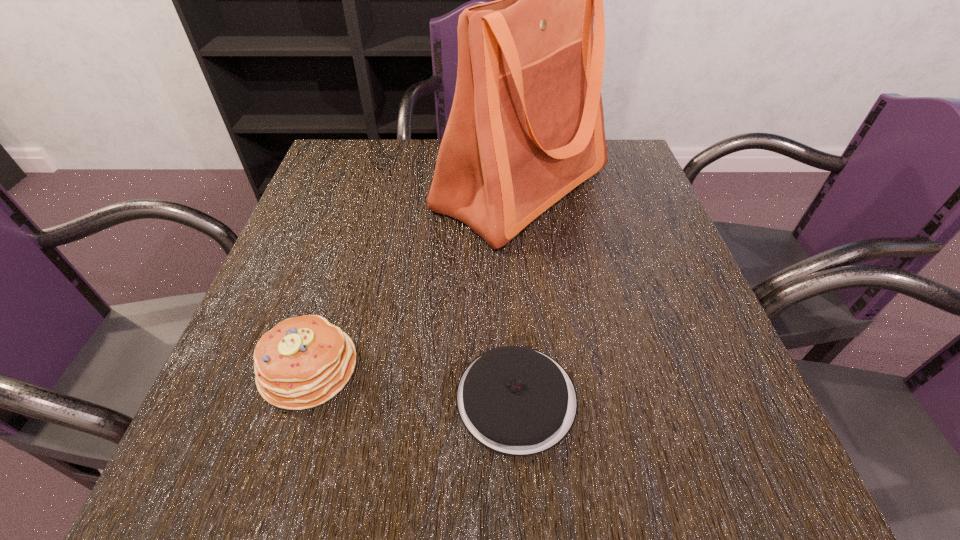
Locate an element on the screen. the farthest object is located at coordinates (526, 127).

This screenshot has width=960, height=540. Find the location of `the tallest object`. the tallest object is located at coordinates (526, 127).

This screenshot has height=540, width=960. I want to click on the second tallest object, so click(x=304, y=361).

Where is `the taller pancake`? The height and width of the screenshot is (540, 960). the taller pancake is located at coordinates (304, 361).

At what (x,y) coordinates should I click in order to perform the action: click on the right pancake. Please return your answer as a coordinate pair (x, y). Image resolution: width=960 pixels, height=540 pixels. Looking at the image, I should click on (516, 400).

The width and height of the screenshot is (960, 540). I want to click on the shortest object, so click(516, 400).

Where is `vacant space located on the left of the shopping bag`? The image size is (960, 540). vacant space located on the left of the shopping bag is located at coordinates click(x=322, y=189).

Identify the location of vacant space located on the right of the taller pancake. (489, 368).

This screenshot has width=960, height=540. What are the coordinates of `free point located on the left of the shorter pancake` in the screenshot? It's located at (254, 398).

Locate an element on the screen. This screenshot has width=960, height=540. object that is at the far edge is located at coordinates (526, 127).